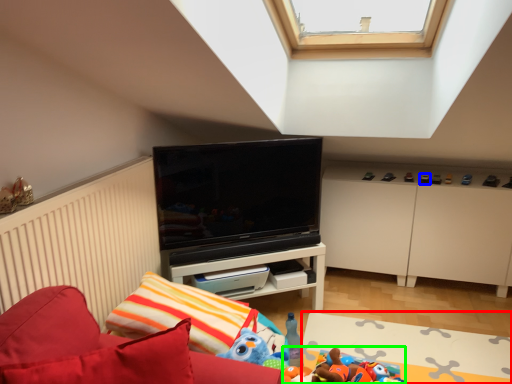
Question: Which object is the closest to the plain (highlighted by a red box)? Choose among these: toy (highlighted by a blue box) or toy (highlighted by a green box).

Choices:
 (A) toy
 (B) toy

Answer: (B)